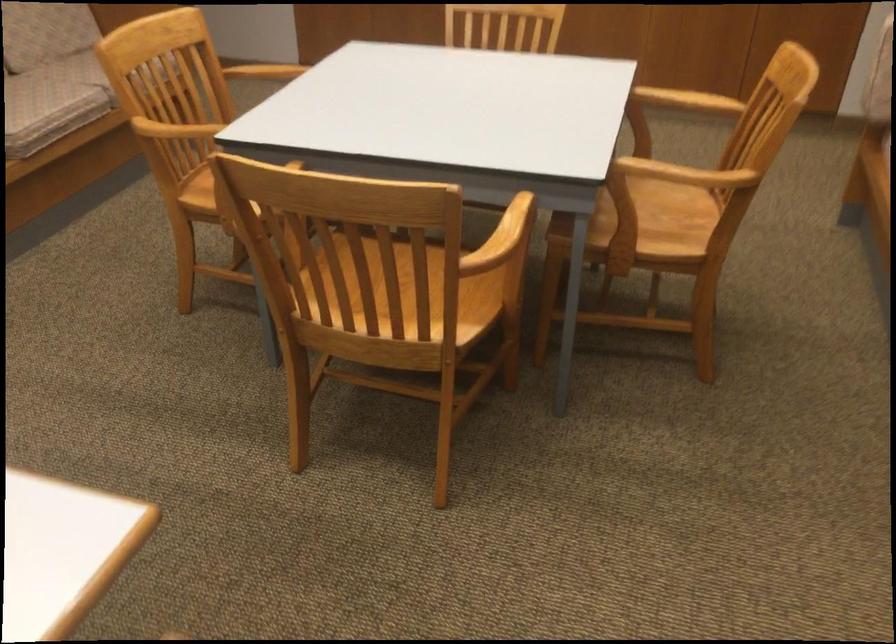
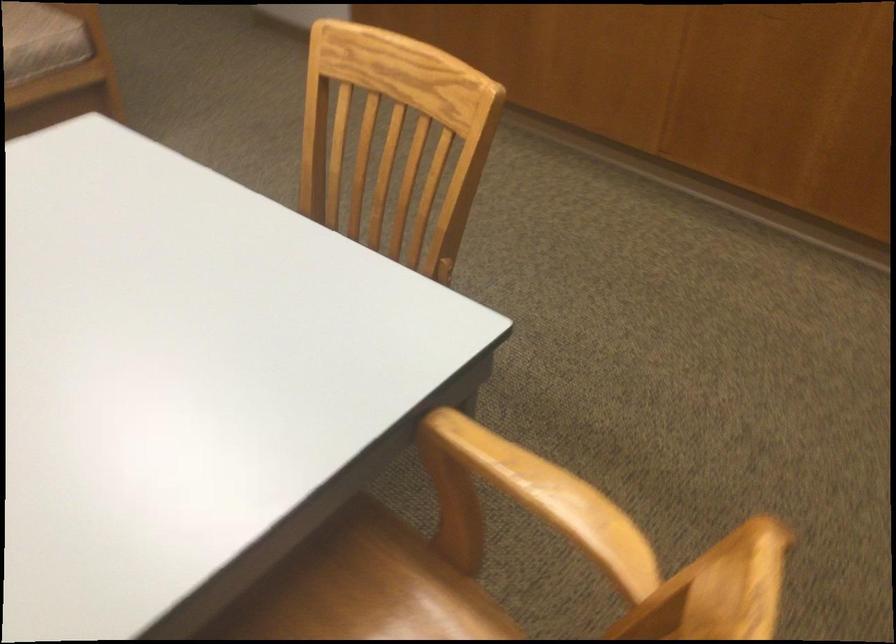
The images are taken continuously from a first-person perspective. In which direction are you moving?

The cameraman moved toward right, forward.